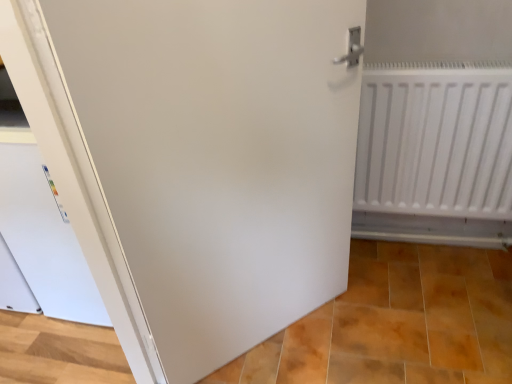
Question: Is white matte radiator at right next to matte white tile at lower center and touching it?

Choices:
 (A) yes
 (B) no

Answer: (B)

Question: Is white matte radiator at right taller than matte white tile at lower center?

Choices:
 (A) yes
 (B) no

Answer: (A)

Question: Does white matte radiator at right appear on the left side of matte white tile at lower center?

Choices:
 (A) no
 (B) yes

Answer: (A)

Question: From the image's perspective, is white matte radiator at right located beneath matte white tile at lower center?

Choices:
 (A) yes
 (B) no

Answer: (B)

Question: Is there a large distance between white matte radiator at right and matte white tile at lower center?

Choices:
 (A) no
 (B) yes

Answer: (A)

Question: From the image's perspective, is matte white tile at lower center above or below white matte radiator at right?

Choices:
 (A) below
 (B) above

Answer: (A)

Question: Is point (418, 292) positioned closer to the camera than point (384, 122)?

Choices:
 (A) farther
 (B) closer

Answer: (A)

Question: Based on their positions, is matte white tile at lower center located to the left or right of white matte radiator at right?

Choices:
 (A) right
 (B) left

Answer: (B)

Question: Is matte white tile at lower center taller or shorter than white matte radiator at right?

Choices:
 (A) tall
 (B) short

Answer: (B)

Question: Considering the positions of white matte radiator at right and white matte door at center in the image, is white matte radiator at right wider or thinner than white matte door at center?

Choices:
 (A) wide
 (B) thin

Answer: (A)

Question: Considering their positions, is white matte radiator at right located in front of or behind white matte door at center?

Choices:
 (A) behind
 (B) front

Answer: (A)

Question: Looking at the image, does white matte radiator at right seem bigger or smaller compared to white matte door at center?

Choices:
 (A) small
 (B) big

Answer: (A)

Question: Do you think white matte radiator at right is within white matte door at center, or outside of it?

Choices:
 (A) outside
 (B) inside

Answer: (A)

Question: Is white matte radiator at right taller or shorter than matte white tile at lower center?

Choices:
 (A) tall
 (B) short

Answer: (A)

Question: Is white matte radiator at right spatially inside matte white tile at lower center, or outside of it?

Choices:
 (A) outside
 (B) inside

Answer: (A)